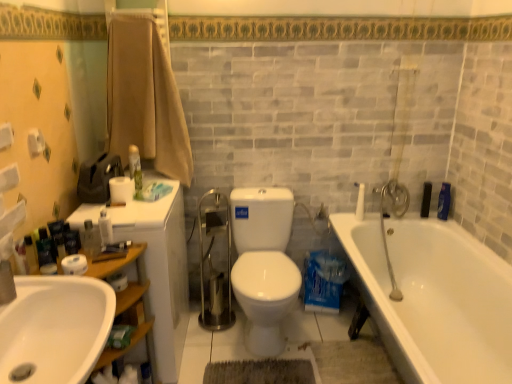
Question: Does white matte toilet paper at lower left, which is counted as the 3th toilet paper, starting from the back, have a larger size compared to white glossy bathtub at lower right?

Choices:
 (A) yes
 (B) no

Answer: (B)

Question: Is white matte toilet paper at lower left, which is counted as the 3th toilet paper, starting from the back, not inside white glossy bathtub at lower right?

Choices:
 (A) no
 (B) yes

Answer: (B)

Question: Can you confirm if white matte toilet paper at lower left, positioned as the 2th toilet paper in bottom-to-top order, is taller than white glossy bathtub at lower right?

Choices:
 (A) yes
 (B) no

Answer: (B)

Question: From the image's perspective, does white matte toilet paper at lower left, positioned as the 2th toilet paper in bottom-to-top order, appear lower than white glossy bathtub at lower right?

Choices:
 (A) yes
 (B) no

Answer: (B)

Question: From the image's perspective, is white matte toilet paper at lower left, the 1th toilet paper from the front, located above white glossy bathtub at lower right?

Choices:
 (A) no
 (B) yes

Answer: (B)

Question: Is white plastic container at left, positioned as the fourth toiletry in back-to-front order, wider or thinner than white ceramic faucet at upper right?

Choices:
 (A) wide
 (B) thin

Answer: (B)

Question: Considering the positions of white plastic container at left, which appears as the 3th toiletry when viewed from the left, and white ceramic faucet at upper right in the image, is white plastic container at left, which appears as the 3th toiletry when viewed from the left, bigger or smaller than white ceramic faucet at upper right?

Choices:
 (A) big
 (B) small

Answer: (B)

Question: Would you say white plastic container at left, which is the third toiletry from front to back, is to the left or to the right of white ceramic faucet at upper right in the picture?

Choices:
 (A) left
 (B) right

Answer: (A)

Question: Relative to white ceramic faucet at upper right, is white plastic container at left, positioned as the fourth toiletry in back-to-front order, in front or behind?

Choices:
 (A) front
 (B) behind

Answer: (A)

Question: In terms of size, does white glossy sink at lower left appear bigger or smaller than blue plastic bottle at right, the 6th toiletry from the left?

Choices:
 (A) small
 (B) big

Answer: (B)

Question: Does point (36, 360) appear closer or farther from the camera than point (445, 187)?

Choices:
 (A) farther
 (B) closer

Answer: (B)

Question: From the image's perspective, is white glossy sink at lower left above or below blue plastic bottle at right, the 5th toiletry when ordered from front to back?

Choices:
 (A) below
 (B) above

Answer: (A)

Question: Would you say white glossy sink at lower left is to the left or to the right of blue plastic bottle at right, which appears as the second toiletry when viewed from the back, in the picture?

Choices:
 (A) right
 (B) left

Answer: (B)

Question: From their relative heights in the image, would you say beige cotton towel at upper left is taller or shorter than white ceramic faucet at upper right?

Choices:
 (A) short
 (B) tall

Answer: (B)

Question: From a real-world perspective, is beige cotton towel at upper left physically located above or below white ceramic faucet at upper right?

Choices:
 (A) below
 (B) above

Answer: (B)